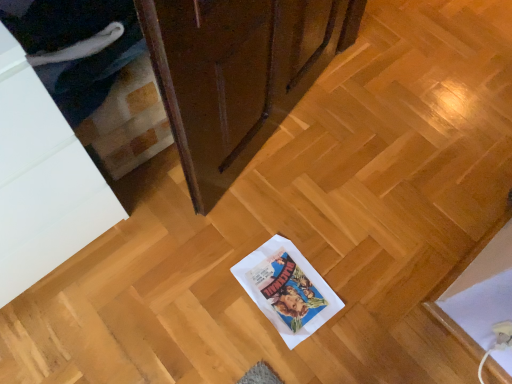
Question: Is white glossy cabinet at left, the 1th cabinetry viewed from the left, wider or thinner than matte brown cabinet at upper center, positioned as the 1th cabinetry in right-to-left order?

Choices:
 (A) wide
 (B) thin

Answer: (A)

Question: From a real-world perspective, is white glossy cabinet at left, which ranks as the second cabinetry in right-to-left order, physically located above or below matte brown cabinet at upper center, positioned as the 1th cabinetry in right-to-left order?

Choices:
 (A) below
 (B) above

Answer: (B)

Question: Is white glossy cabinet at left, which ranks as the second cabinetry in right-to-left order, bigger or smaller than matte brown cabinet at upper center, positioned as the 1th cabinetry in right-to-left order?

Choices:
 (A) small
 (B) big

Answer: (B)

Question: From a real-world perspective, is matte brown cabinet at upper center, the 2th cabinetry from the left, positioned above or below white glossy cabinet at left, the 1th cabinetry viewed from the left?

Choices:
 (A) below
 (B) above

Answer: (A)

Question: In the image, is matte brown cabinet at upper center, the 2th cabinetry from the left, positioned in front of or behind white glossy cabinet at left, which ranks as the second cabinetry in right-to-left order?

Choices:
 (A) behind
 (B) front

Answer: (A)

Question: Would you say matte brown cabinet at upper center, the 2th cabinetry from the left, is to the left or to the right of white glossy cabinet at left, which ranks as the second cabinetry in right-to-left order, in the picture?

Choices:
 (A) left
 (B) right

Answer: (B)

Question: Based on their sizes in the image, would you say matte brown cabinet at upper center, positioned as the 1th cabinetry in right-to-left order, is bigger or smaller than white glossy cabinet at left, the 1th cabinetry viewed from the left?

Choices:
 (A) small
 (B) big

Answer: (A)